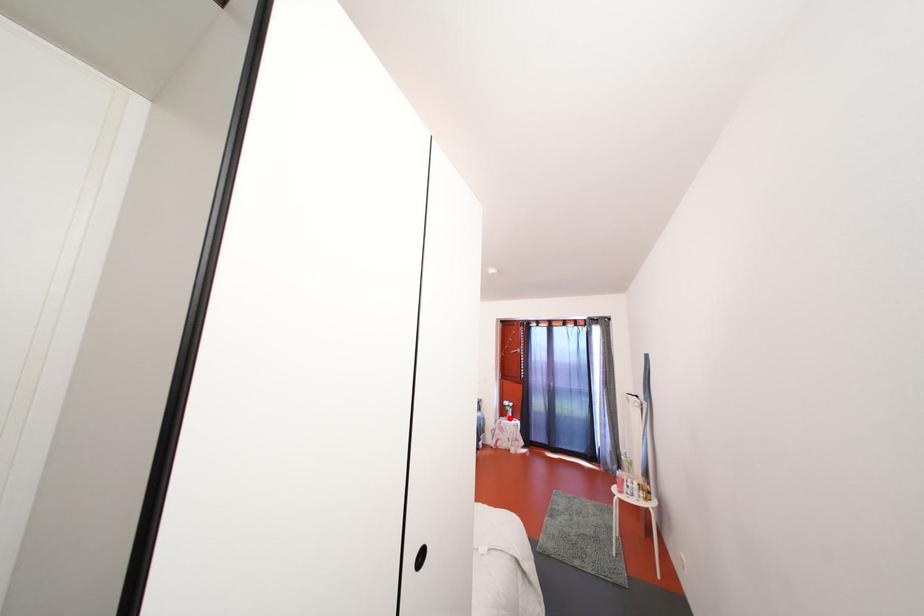
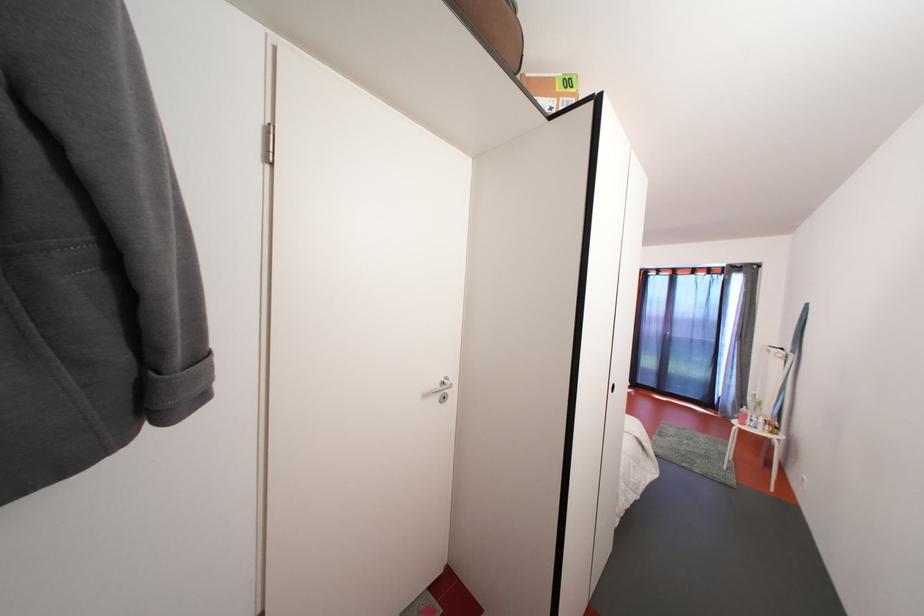
Question: I am providing you with two images of the same scene from different viewpoints. A red point is marked on the first image. Is the red point's position out of view in image 2?

Choices:
 (A) Yes
 (B) No

Answer: (A)